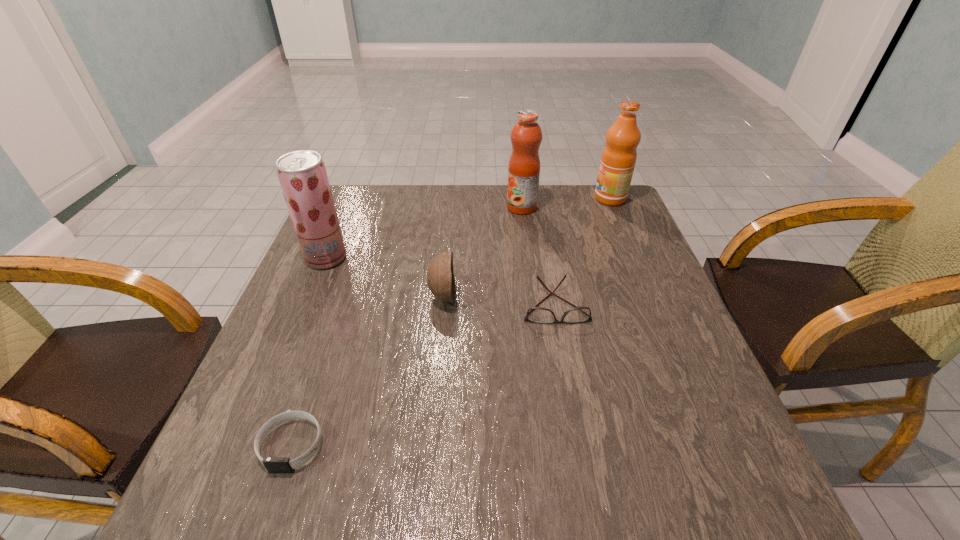
Find the location of a particular element. The height and width of the screenshot is (540, 960). blank region between the spectacles and the rightmost fruit juice is located at coordinates point(583,252).

Where is `vacant space that's between the nearest fruit juice and the fourth object from right to left`? vacant space that's between the nearest fruit juice and the fourth object from right to left is located at coordinates (384, 277).

Identify the location of free point between the nearest object and the nearest fruit juice. (309, 352).

Where is `free space between the second fruit juice from right to left and the leftmost fruit juice`? Image resolution: width=960 pixels, height=540 pixels. free space between the second fruit juice from right to left and the leftmost fruit juice is located at coordinates (424, 233).

In order to click on blank region between the rightmost fruit juice and the nearest object in this screenshot , I will do `click(451, 322)`.

Identify the location of free spot between the second fruit juice from right to left and the third farthest object. This screenshot has height=540, width=960. (424, 233).

Find the location of a particular element. free area in between the bowl and the rightmost fruit juice is located at coordinates (526, 247).

The width and height of the screenshot is (960, 540). I want to click on vacant area that lies between the rightmost object and the spectacles, so click(x=583, y=252).

Locate an element on the screen. The width and height of the screenshot is (960, 540). free space between the wristband and the leftmost fruit juice is located at coordinates (309, 352).

You are a GUI agent. You are given a task and a screenshot of the screen. Output one action in this format:
    pyautogui.click(x=<x>, y=<y>)
    Task: Click on the object that is the fourth closest to the third object from left to right
    Image resolution: width=960 pixels, height=540 pixels.
    Given the screenshot: What is the action you would take?
    pyautogui.click(x=526, y=136)